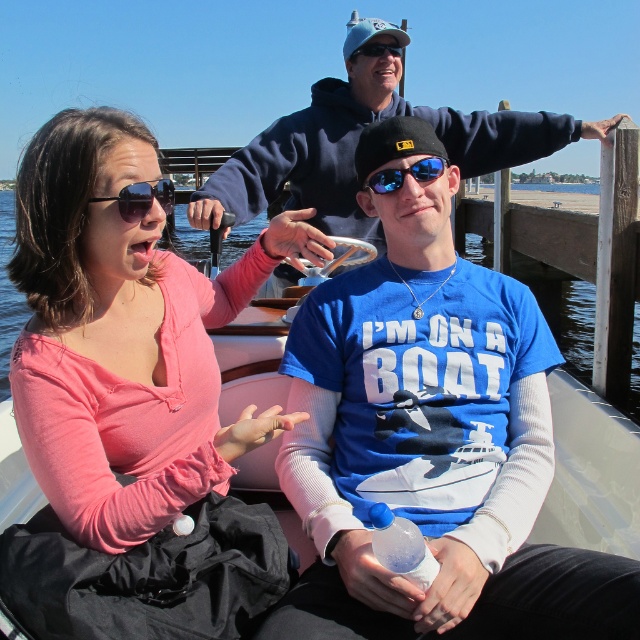
Consider the image. Between white plastic boat at center and blue reflective sunglasses at upper center, which one has more height?

With more height is white plastic boat at center.

Identify the location of white plastic boat at center. The width and height of the screenshot is (640, 640). (589, 474).

Find the location of `white plastic boat at center`. white plastic boat at center is located at coordinates (589, 474).

Which is below, pink fabric shirt at left or black reflective sunglasses at upper left?

→ Positioned lower is pink fabric shirt at left.

Is pink fabric shirt at left wider than black reflective sunglasses at upper left?

Indeed, pink fabric shirt at left has a greater width compared to black reflective sunglasses at upper left.

Based on the photo, who is more distant from viewer, (x=83, y=298) or (x=141, y=204)?

The point (x=83, y=298) is more distant.

Locate an element on the screen. pink fabric shirt at left is located at coordinates (124, 337).

Measure the distance between white plastic boat at center and clear water at center.

A distance of 9.90 meters exists between white plastic boat at center and clear water at center.

Who is more forward, (252, 388) or (246, 244)?

Point (252, 388)

Is point (541, 540) closer to camera compared to point (180, 253)?

Yes, point (541, 540) is in front of point (180, 253).

This screenshot has width=640, height=640. In order to click on white plastic boat at center in this screenshot , I will do (589, 474).